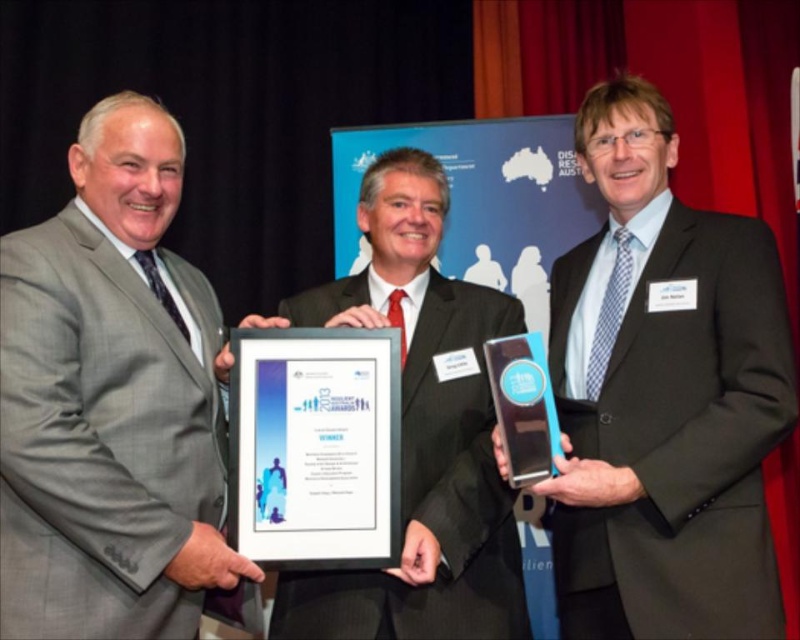
Question: Among these objects, which one is farthest from the camera?

Choices:
 (A) matte gray suit at center
 (B) matte black suit at center

Answer: (B)

Question: From the image, what is the correct spatial relationship of matte black suit at center in relation to matte gray suit at center?

Choices:
 (A) left
 (B) right

Answer: (B)

Question: Is matte black suit at center positioned at the back of matte gray suit at center?

Choices:
 (A) no
 (B) yes

Answer: (B)

Question: Does matte black suit at center have a lesser width compared to matte gray suit at center?

Choices:
 (A) yes
 (B) no

Answer: (B)

Question: Which of the following is the farthest from the observer?

Choices:
 (A) (142, 618)
 (B) (741, 618)

Answer: (B)